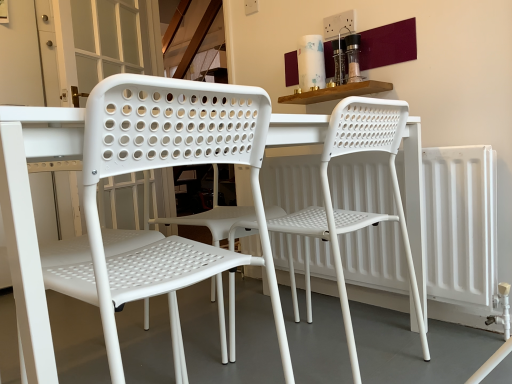
Question: From their relative heights in the image, would you say white plastic chair at center, which is the 2th chair from right to left, is taller or shorter than white matte radiator at right?

Choices:
 (A) tall
 (B) short

Answer: (A)

Question: Would you say white plastic chair at center, marked as the 1th chair in a left-to-right arrangement, is to the left or to the right of white matte radiator at right in the picture?

Choices:
 (A) right
 (B) left

Answer: (B)

Question: Considering the real-world distances, which object is farthest from the white plastic chair at center, marked as the 1th chair in a left-to-right arrangement?

Choices:
 (A) white plastic chair at center, the 1th chair viewed from the right
 (B) white matte radiator at right

Answer: (B)

Question: Which object is positioned closest to the white plastic chair at center, placed as the 2th chair when sorted from left to right?

Choices:
 (A) white plastic chair at center, which is the 2th chair from right to left
 (B) white matte radiator at right

Answer: (B)